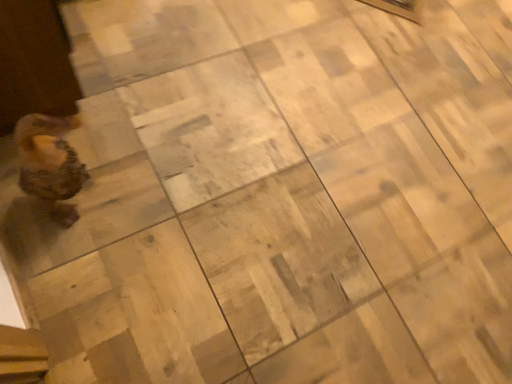
Identify the location of vacant area that lies to the right of brown fabric at lower left. (138, 110).